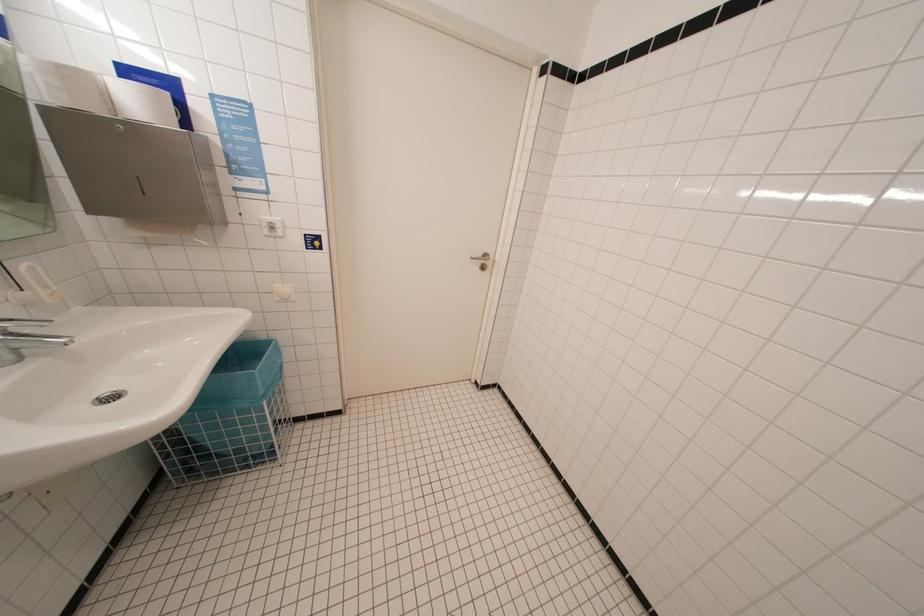
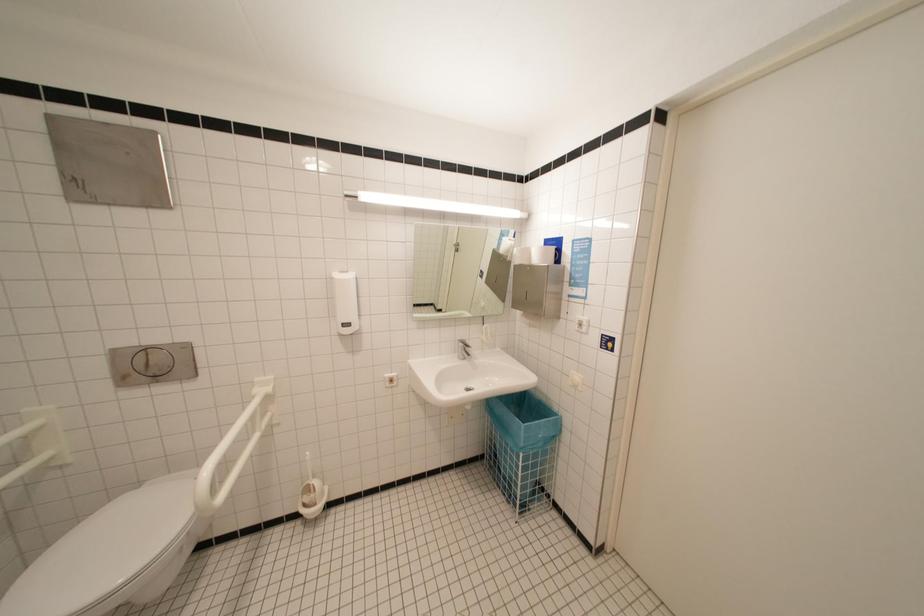
Question: The camera is either moving clockwise (left) or counter-clockwise (right) around the object. The first image is from the beginning of the video and the second image is from the end. Is the camera moving left or right when shooting the video?

Choices:
 (A) Left
 (B) Right

Answer: (B)